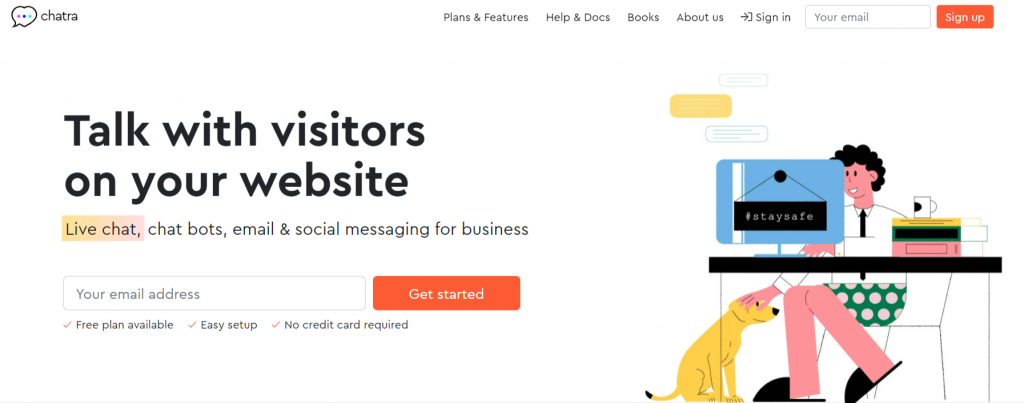
Identify the location of books. This screenshot has width=1024, height=403. (914, 243).